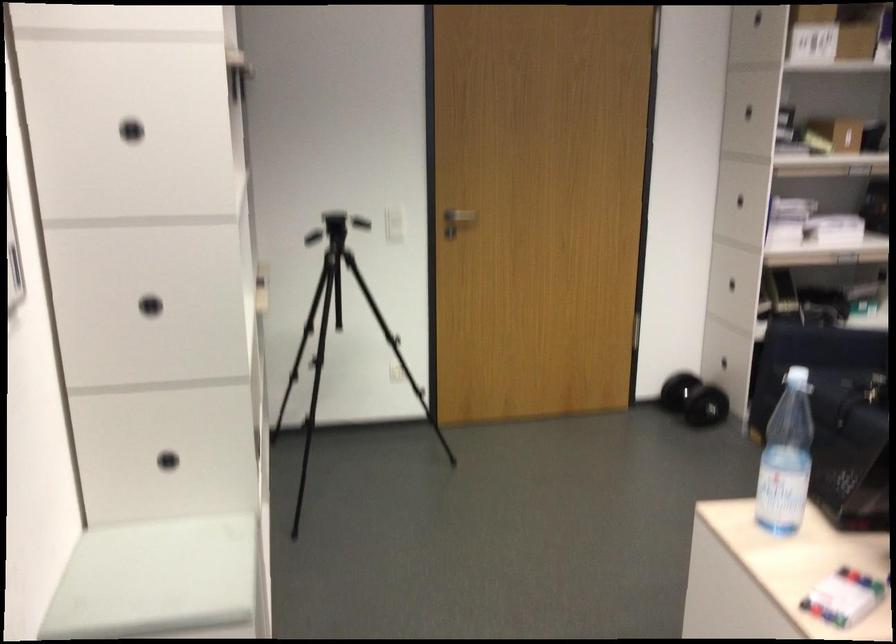
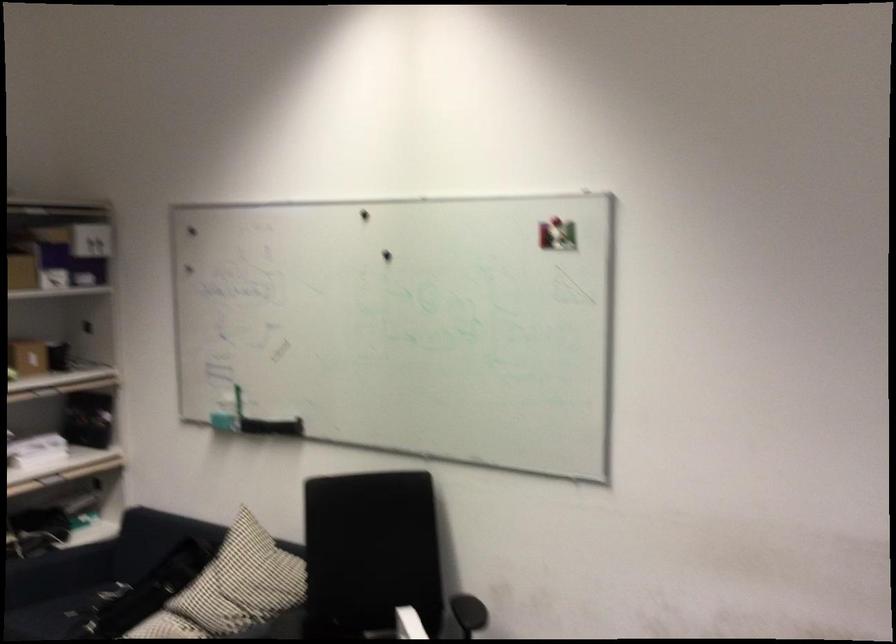
The point at (817,399) is marked in the first image. Where is the corresponding point in the second image?

(59, 614)